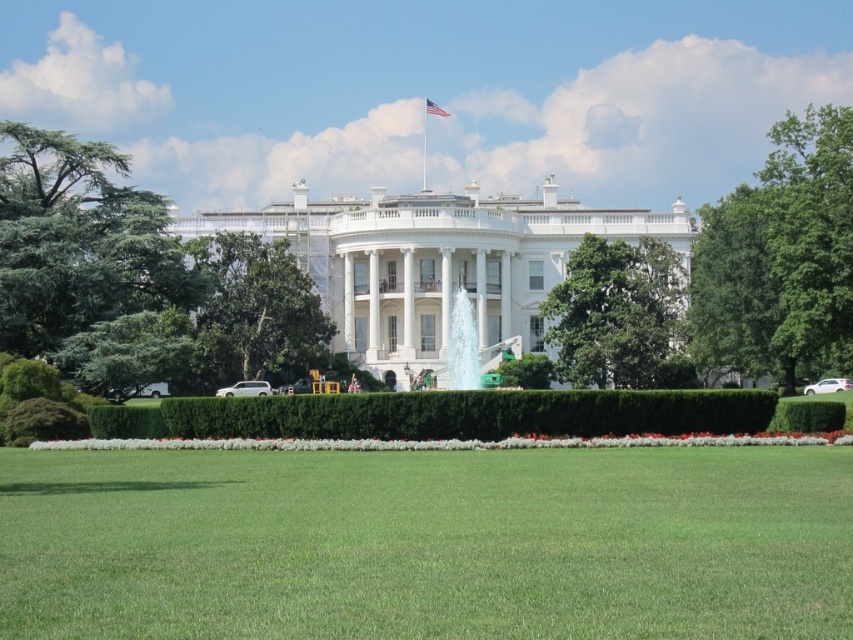
Question: Which point appears closest to the camera in this image?

Choices:
 (A) (271, 598)
 (B) (428, 108)
 (C) (10, 122)

Answer: (A)

Question: Is green leafy tree at left above american flag at upper center?

Choices:
 (A) yes
 (B) no

Answer: (B)

Question: Can you confirm if green leafy tree at center is smaller than american flag at upper center?

Choices:
 (A) yes
 (B) no

Answer: (B)

Question: Estimate the real-world distances between objects in this image. Which object is closer to the green leafy tree at center?

Choices:
 (A) green leafy hedge at center
 (B) green leafy tree at center-right
 (C) american flag at upper center

Answer: (B)

Question: Which is nearer to the green leafy tree at center?

Choices:
 (A) green leafy tree at left
 (B) green grass at center

Answer: (A)

Question: Is green leafy tree at left below american flag at upper center?

Choices:
 (A) no
 (B) yes

Answer: (B)